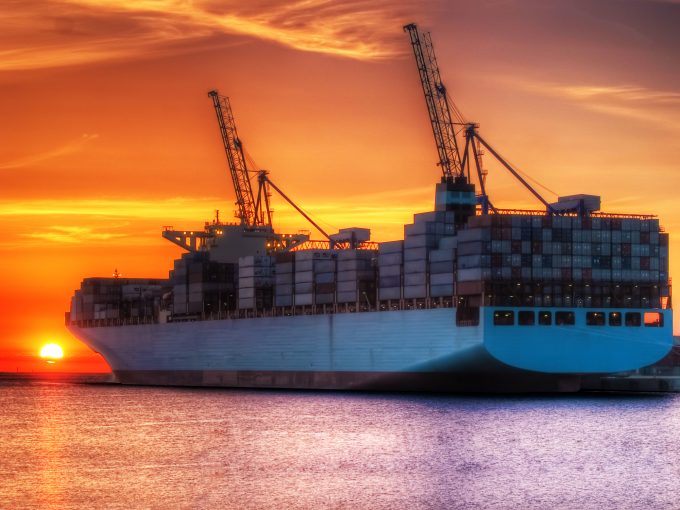
You are a GUI agent. You are given a task and a screenshot of the screen. Output one action in this format:
    pyautogui.click(x=<x>, y=<y>)
    Task: Click on the windows
    The image size is (680, 510).
    Given the screenshot: What is the action you would take?
    pyautogui.click(x=564, y=319)